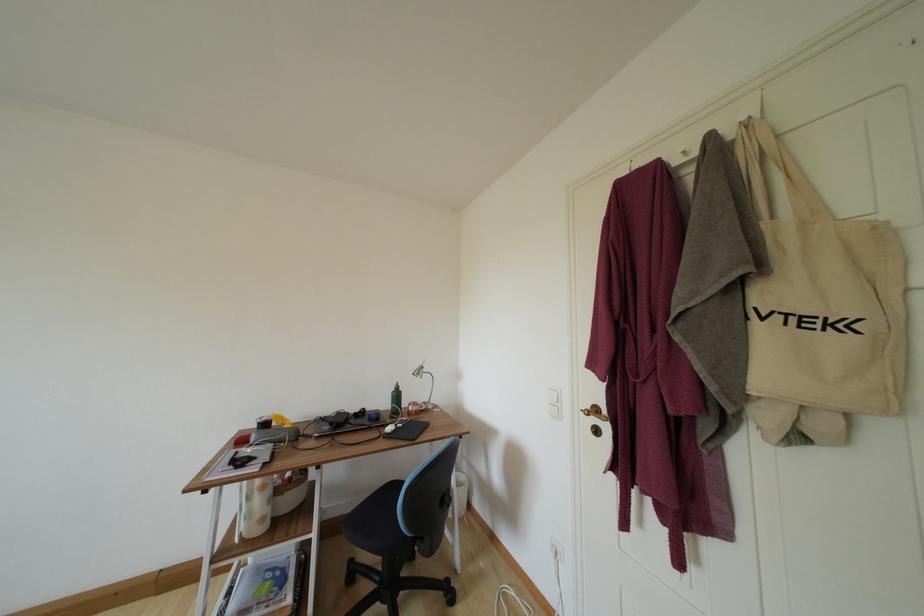
Find the location of a particular element. Image resolution: width=924 pixels, height=616 pixels. tote bag handle is located at coordinates (766, 138).